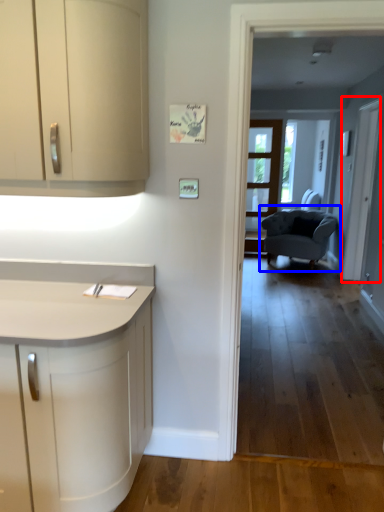
Question: Among these objects, which one is farthest to the camera, screen door (highlighted by a red box) or chair (highlighted by a blue box)?

Choices:
 (A) screen door
 (B) chair

Answer: (B)